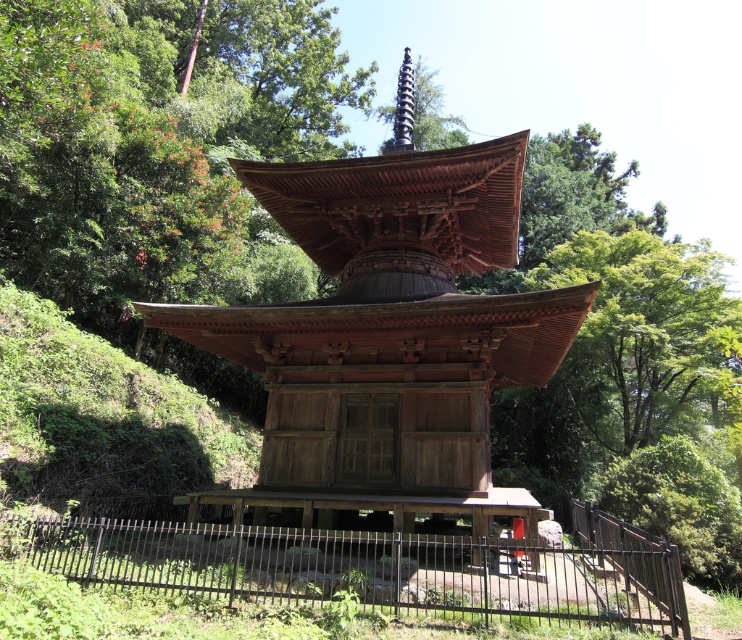
Question: In this image, where is wooden pagoda at center located relative to black wrought iron fence at lower center?

Choices:
 (A) left
 (B) right

Answer: (B)

Question: Which of the following is the closest to the observer?

Choices:
 (A) wooden pagoda at center
 (B) black wrought iron fence at lower center

Answer: (B)

Question: Can you confirm if wooden pagoda at center is bigger than black wrought iron fence at lower center?

Choices:
 (A) no
 (B) yes

Answer: (A)

Question: Observing the image, what is the correct spatial positioning of wooden pagoda at center in reference to black wrought iron fence at lower center?

Choices:
 (A) left
 (B) right

Answer: (B)

Question: Which point is closer to the camera?

Choices:
 (A) (326, 396)
 (B) (377, 556)

Answer: (B)